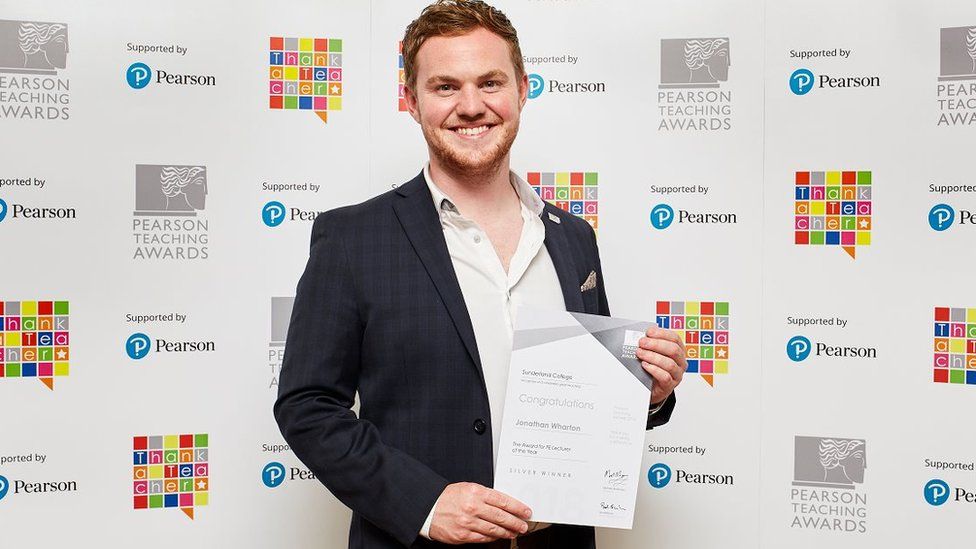
This screenshot has height=549, width=976. Find the location of `wall`. wall is located at coordinates (582, 125).